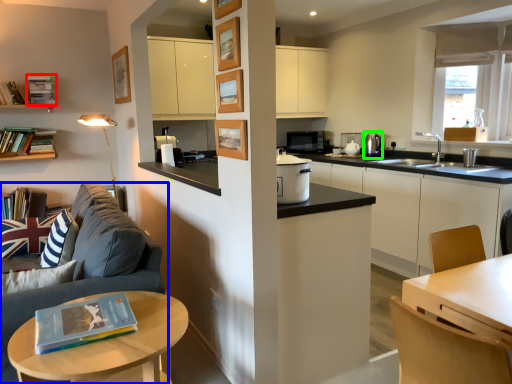
Question: Which object is positioned closest to book (highlighted by a red box)? Select from studio couch (highlighted by a blue box) and appliance (highlighted by a green box).

Choices:
 (A) studio couch
 (B) appliance

Answer: (A)